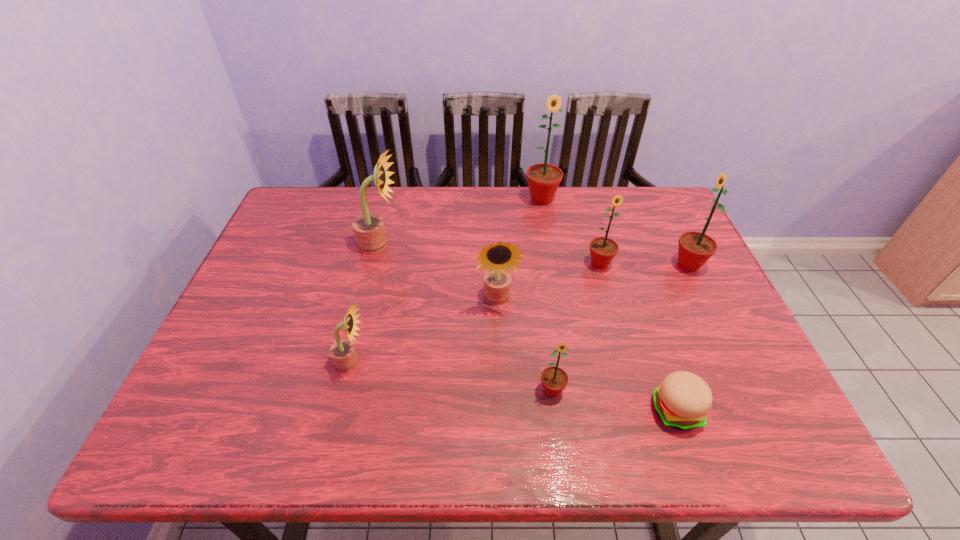
Where is `vacant space located on the face of the second smallest green sunflower`? This screenshot has width=960, height=540. vacant space located on the face of the second smallest green sunflower is located at coordinates (635, 388).

Find the location of a particular element. blank space located 0.200m on the face of the fourth nearest object is located at coordinates click(500, 384).

Image resolution: width=960 pixels, height=540 pixels. What are the coordinates of `free region located 0.110m on the face of the smallest yellow sunflower` in the screenshot? It's located at tap(416, 362).

Locate an element on the screen. This screenshot has width=960, height=540. blank space located on the back of the hamburger is located at coordinates (637, 297).

At what (x,y) coordinates should I click in order to perform the action: click on object located at the near edge. Please return your answer as a coordinate pair (x, y). The height and width of the screenshot is (540, 960). Looking at the image, I should click on coord(683,399).

Locate an element on the screen. object that is at the right edge is located at coordinates (695, 248).

What are the coordinates of `vacant space at the far edge of the desktop` in the screenshot? It's located at (585, 194).

Where is `vacant space at the near edge of the desktop`? This screenshot has height=540, width=960. vacant space at the near edge of the desktop is located at coordinates (439, 428).

You are a GUI agent. You are given a task and a screenshot of the screen. Output one action in this format:
    pyautogui.click(x=<x>, y=<y>)
    Task: Click on the vacant space at the left edge of the desktop
    The height and width of the screenshot is (540, 960).
    Given the screenshot: What is the action you would take?
    coord(219,404)

Locate an element on the screen. vacant space at the right edge of the desktop is located at coordinates (705, 296).